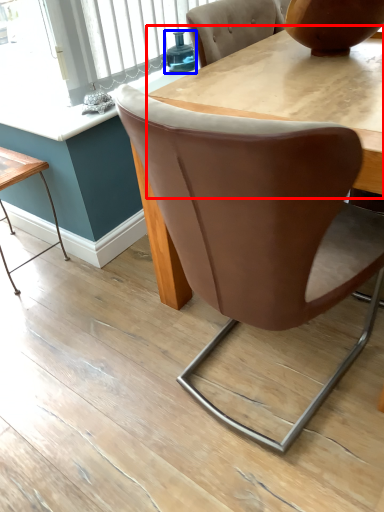
Question: Which object appears closest to the camera in this image, round table (highlighted by a red box) or teal (highlighted by a blue box)?

Choices:
 (A) round table
 (B) teal

Answer: (A)